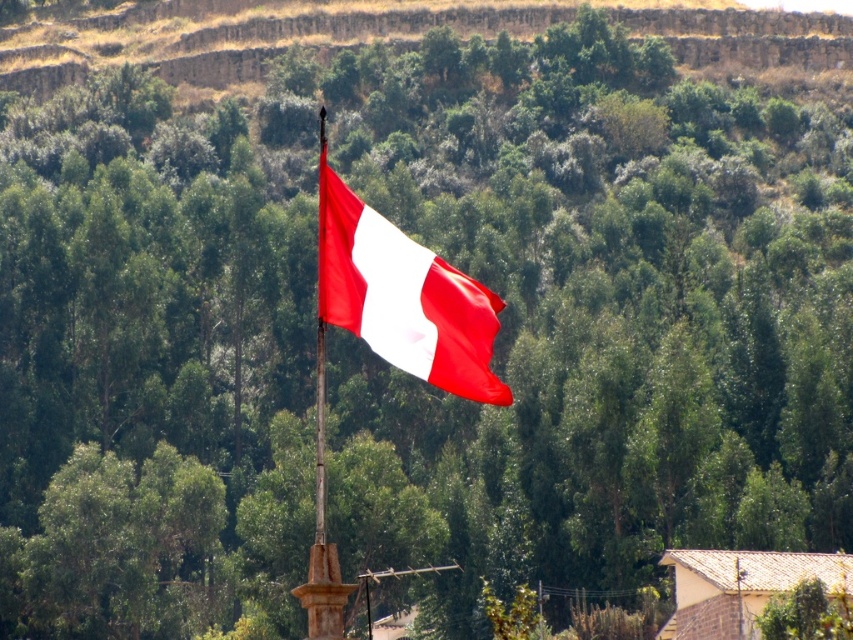
From the picture: You are a photographer aiming to capture the matte fabric flag at center and the smooth wood flag pole at center in a single shot. Which object should you focus on first if you want to ensure both are in sharp focus?

The smooth wood flag pole at center should be focused on first because it is closer to the photographer than the matte fabric flag at center, which is located above it. By focusing on the closer object, the flag pole, the flag will also be within the depth of field and appear sharp.

You are a photographer planning to capture the matte fabric flag at center and the smooth wood flag pole at center in a single shot. Based on their heights, which object will appear shorter in the photograph?

The matte fabric flag at center appears shorter in the photograph because it has a lesser height compared to the smooth wood flag pole at center.